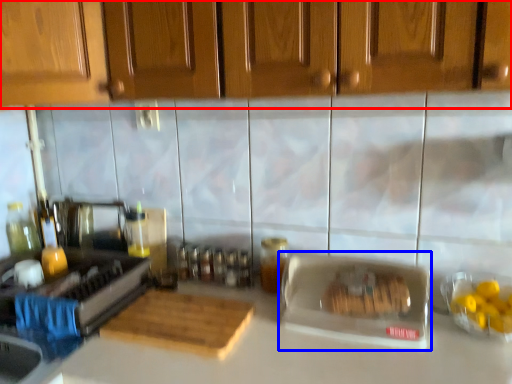
Question: Among these objects, which one is nearest to the camera, cabinetry (highlighted by a red box) or appliance (highlighted by a blue box)?

Choices:
 (A) cabinetry
 (B) appliance

Answer: (A)